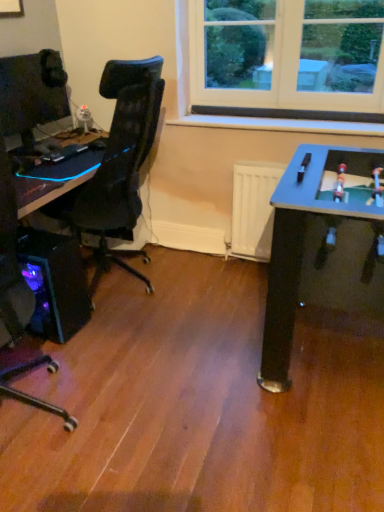
The height and width of the screenshot is (512, 384). I want to click on translucent purple plastic computer tower at lower left, so click(x=55, y=283).

You are a GUI agent. You are given a task and a screenshot of the screen. Output one action in this format:
    pyautogui.click(x=<x>, y=<y>)
    Task: Click on the matte black monitor at left
    Image resolution: width=384 pixels, height=512 pixels.
    Given the screenshot: What is the action you would take?
    pyautogui.click(x=32, y=93)

You are a GUI agent. You are given a task and a screenshot of the screen. Output one action in this format:
    pyautogui.click(x=<x>, y=<y>)
    Task: Click on the computer monitor that appears in front of the white plastic toy at upper center
    
    Given the screenshot: What is the action you would take?
    pyautogui.click(x=32, y=93)

Is matte black monitor at left situated inside white plastic toy at upper center or outside?

matte black monitor at left is not enclosed by white plastic toy at upper center.

Is matte black monitor at left to the left or to the right of white plastic toy at upper center in the image?

matte black monitor at left is to the left of white plastic toy at upper center.

From a real-world perspective, is matte black monitor at left located higher than white plastic toy at upper center?

Yes, from a real-world perspective, matte black monitor at left is over white plastic toy at upper center

From a real-world perspective, which is physically above, white plastic toy at upper center or black plastic desk at left?

From a 3D spatial view, white plastic toy at upper center is above.

Which is behind, point (79, 117) or point (21, 194)?

Positioned behind is point (79, 117).

From the image's perspective, is white plastic toy at upper center above or below black plastic desk at left?

white plastic toy at upper center is situated higher than black plastic desk at left in the image.

Is the surface of black plastic desk at left in direct contact with matte black monitor at left?

black plastic desk at left is not next to matte black monitor at left, and they're not touching.

From the image's perspective, relative to matte black monitor at left, is black plastic desk at left above or below?

From the image's perspective, black plastic desk at left appears below matte black monitor at left.

Which object is positioned more to the right, black plastic desk at left or matte black monitor at left?

From the viewer's perspective, black plastic desk at left appears more on the right side.

Based on the photo, from a real-world perspective, between black plastic desk at left and matte black monitor at left, who is vertically lower?

From a 3D spatial view, black plastic desk at left is below.

Can you confirm if translucent purple plastic computer tower at lower left is bigger than matte black monitor at left?

Indeed, translucent purple plastic computer tower at lower left has a larger size compared to matte black monitor at left.

Can you confirm if translucent purple plastic computer tower at lower left is thinner than matte black monitor at left?

Incorrect, the width of translucent purple plastic computer tower at lower left is not less than that of matte black monitor at left.

Identify the location of computer tower in front of the matte black monitor at left. (55, 283).

Is point (44, 276) closer to viewer compared to point (29, 97)?

Yes, point (44, 276) is in front of point (29, 97).

Is white plastic toy at upper center further to camera compared to matte black monitor at left?

Yes, white plastic toy at upper center is further from the camera.

From a real-world perspective, which is physically above, white plastic toy at upper center or matte black monitor at left?

From a 3D spatial view, matte black monitor at left is above.

Does point (88, 112) lie in front of point (28, 129)?

No, (88, 112) is further to viewer.

Is white plastic toy at upper center wider or thinner than matte black monitor at left?

white plastic toy at upper center is thinner than matte black monitor at left.

Is translucent purple plastic computer tower at lower left touching white plastic toy at upper center?

No.

Does translucent purple plastic computer tower at lower left appear on the left side of white plastic toy at upper center?

Indeed, translucent purple plastic computer tower at lower left is positioned on the left side of white plastic toy at upper center.

Where is `computer tower located below the white plastic toy at upper center (from the image's perspective)`? This screenshot has width=384, height=512. computer tower located below the white plastic toy at upper center (from the image's perspective) is located at coordinates (55, 283).

From the image's perspective, is matte black monitor at left beneath translucent purple plastic computer tower at lower left?

No, from the image's perspective, matte black monitor at left is not beneath translucent purple plastic computer tower at lower left.

Does point (42, 64) come in front of point (17, 251)?

That is False.

Is matte black monitor at left facing away from translucent purple plastic computer tower at lower left?

No.

Is matte black monitor at left located outside translucent purple plastic computer tower at lower left?

Yes, matte black monitor at left is not within translucent purple plastic computer tower at lower left.

Locate an element on the screen. computer monitor above the white plastic toy at upper center (from the image's perspective) is located at coordinates (32, 93).

Locate an element on the screen. This screenshot has width=384, height=512. table lying in front of the white plastic toy at upper center is located at coordinates (53, 181).

From the picture: Based on their spatial positions, is matte black monitor at left or translucent purple plastic computer tower at lower left closer to white plastic toy at upper center?

Based on the image, matte black monitor at left appears to be nearer to white plastic toy at upper center.

From the image, which object appears to be farther from matte black monitor at left, white plastic toy at upper center or translucent purple plastic computer tower at lower left?

translucent purple plastic computer tower at lower left lies further to matte black monitor at left than the other object.

Based on their spatial positions, is black plastic desk at left or white plastic toy at upper center further from translucent purple plastic computer tower at lower left?

Among the two, white plastic toy at upper center is located further to translucent purple plastic computer tower at lower left.

Based on their spatial positions, is matte black monitor at left or white plastic toy at upper center further from black plastic desk at left?

The object further to black plastic desk at left is white plastic toy at upper center.

Based on their spatial positions, is matte black monitor at left or black plastic desk at left closer to white plastic toy at upper center?

matte black monitor at left lies closer to white plastic toy at upper center than the other object.

Based on their spatial positions, is white plastic toy at upper center or black plastic desk at left closer to matte black monitor at left?

Among the two, black plastic desk at left is located nearer to matte black monitor at left.

From the image, which object appears to be farther from translucent purple plastic computer tower at lower left, white plastic toy at upper center or matte black monitor at left?

white plastic toy at upper center lies further to translucent purple plastic computer tower at lower left than the other object.

Based on their spatial positions, is matte black monitor at left or black plastic desk at left further from translucent purple plastic computer tower at lower left?

matte black monitor at left is positioned further to the anchor translucent purple plastic computer tower at lower left.

This screenshot has height=512, width=384. I want to click on table between matte black monitor at left and translucent purple plastic computer tower at lower left vertically, so click(53, 181).

Where is `computer monitor positioned between black plastic desk at left and white plastic toy at upper center from near to far`? The width and height of the screenshot is (384, 512). computer monitor positioned between black plastic desk at left and white plastic toy at upper center from near to far is located at coordinates (32, 93).

Find the location of a particular element. table that lies between white plastic toy at upper center and translucent purple plastic computer tower at lower left from top to bottom is located at coordinates (53, 181).

Locate an element on the screen. toy between matte black monitor at left and translucent purple plastic computer tower at lower left from top to bottom is located at coordinates (84, 119).